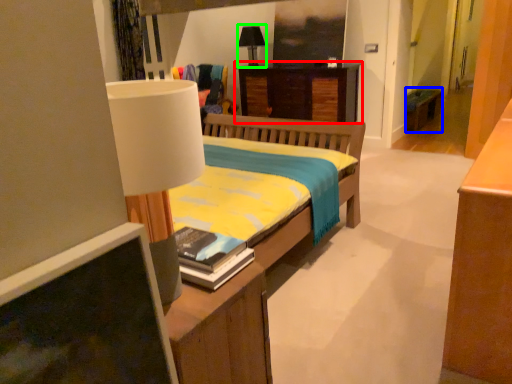
Question: Which object is positioned farthest from desk (highlighted by a red box)? Select from table (highlighted by a blue box) and table lamp (highlighted by a green box).

Choices:
 (A) table
 (B) table lamp

Answer: (A)